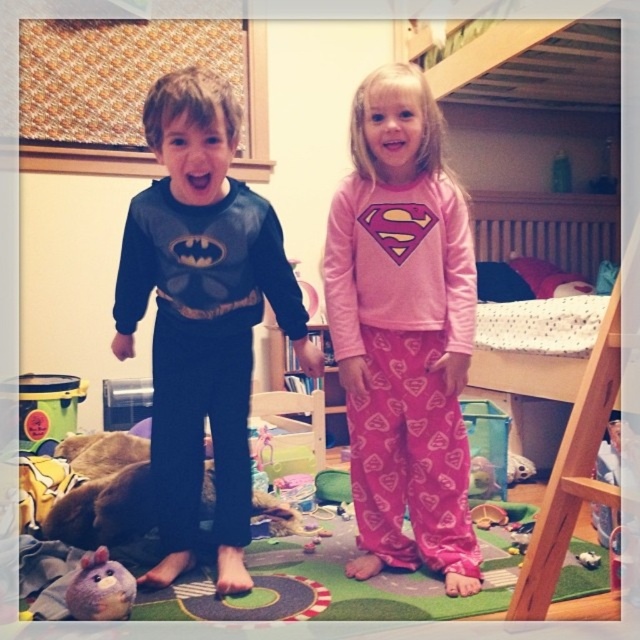
Question: Does matte black sweatshirt at center come behind brown fur dog at lower left?

Choices:
 (A) yes
 (B) no

Answer: (B)

Question: Which object is positioned farthest from the matte black sweatshirt at center?

Choices:
 (A) pink heart-patterned pajamas at center
 (B) brown fur dog at lower left

Answer: (B)

Question: Does pink heart-patterned pajamas at center have a smaller size compared to brown fur dog at lower left?

Choices:
 (A) yes
 (B) no

Answer: (B)

Question: Among these points, which one is farthest from the camera?

Choices:
 (A) (56, 529)
 (B) (218, 320)

Answer: (A)

Question: Estimate the real-world distances between objects in this image. Which object is closer to the matte black sweatshirt at center?

Choices:
 (A) pink heart-patterned pajamas at center
 (B) brown fur dog at lower left

Answer: (A)

Question: Is pink heart-patterned pajamas at center closer to camera compared to matte black sweatshirt at center?

Choices:
 (A) no
 (B) yes

Answer: (A)